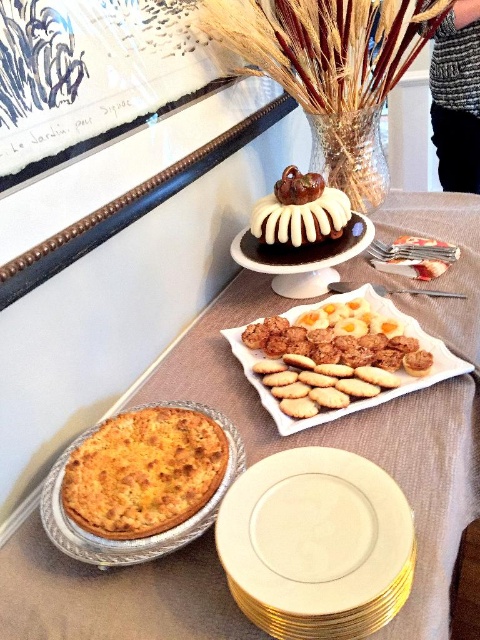
Is point (409, 221) farther from camera compared to point (400, 381)?

Yes.

Can you confirm if shiny aluminum pie tin at lower left is wider than white matte platter at center?

Indeed, shiny aluminum pie tin at lower left has a greater width compared to white matte platter at center.

Who is more distant from viewer, (x=110, y=605) or (x=359, y=289)?

Point (x=359, y=289)

What are the coordinates of `shiny aluminum pie tin at lower left` in the screenshot? It's located at (349, 442).

Is shiny aluminum pie tin at lower left shorter than white porcelain plate at center?

No.

Between point (442, 508) and point (256, 611), which one is positioned in front?

Point (256, 611) is more forward.

What do you see at coordinates (349, 442) in the screenshot? The width and height of the screenshot is (480, 640). I see `shiny aluminum pie tin at lower left` at bounding box center [349, 442].

Identify the location of shiny aluminum pie tin at lower left. (349, 442).

Does shiny aluminum pie tin at lower left have a lesser height compared to golden aluminum pie at lower left?

Incorrect, shiny aluminum pie tin at lower left's height does not fall short of golden aluminum pie at lower left's.

Does point (457, 532) come farther from viewer compared to point (213, 513)?

Yes, it is behind point (213, 513).

Is point (338, 426) behind point (87, 563)?

Yes, it is.

Find the location of `shiny aluminum pie tin at lower left`. shiny aluminum pie tin at lower left is located at coordinates (349, 442).